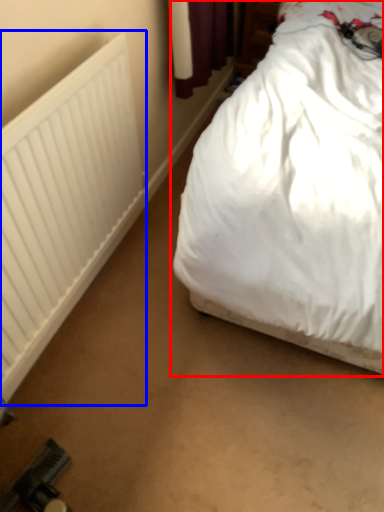
Question: Which object is closer to the camera taking this photo, bed (highlighted by a red box) or radiator (highlighted by a blue box)?

Choices:
 (A) bed
 (B) radiator

Answer: (A)